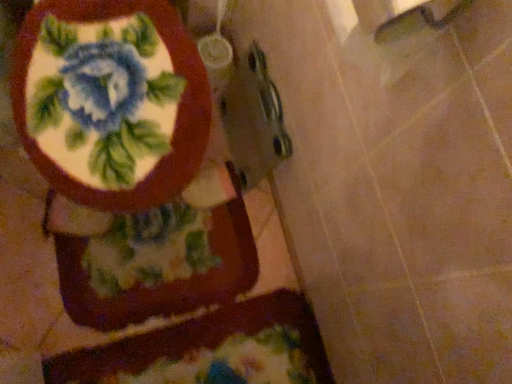
I want to click on vacant space underneath fluffy multicolored bath mat at lower center (from a real-world perspective), so click(x=195, y=362).